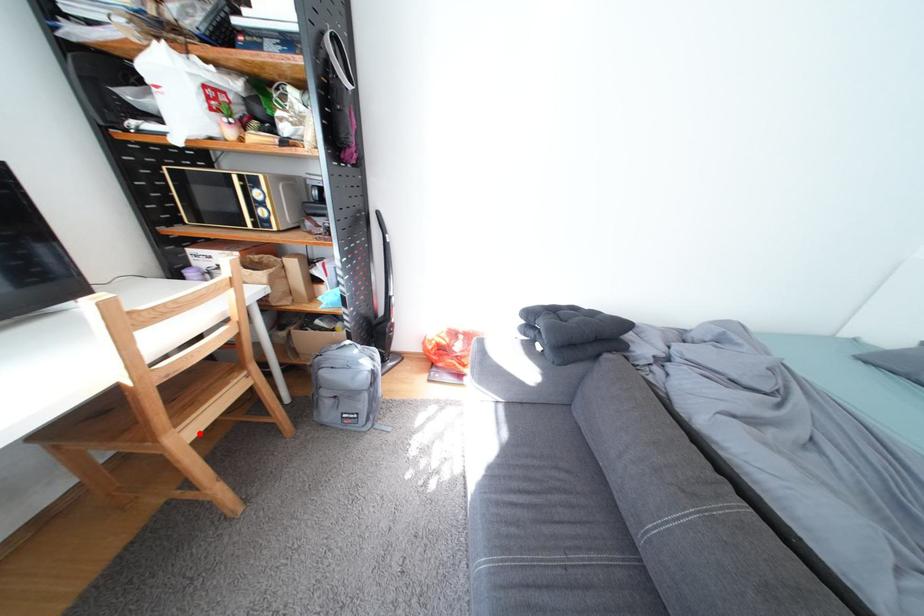
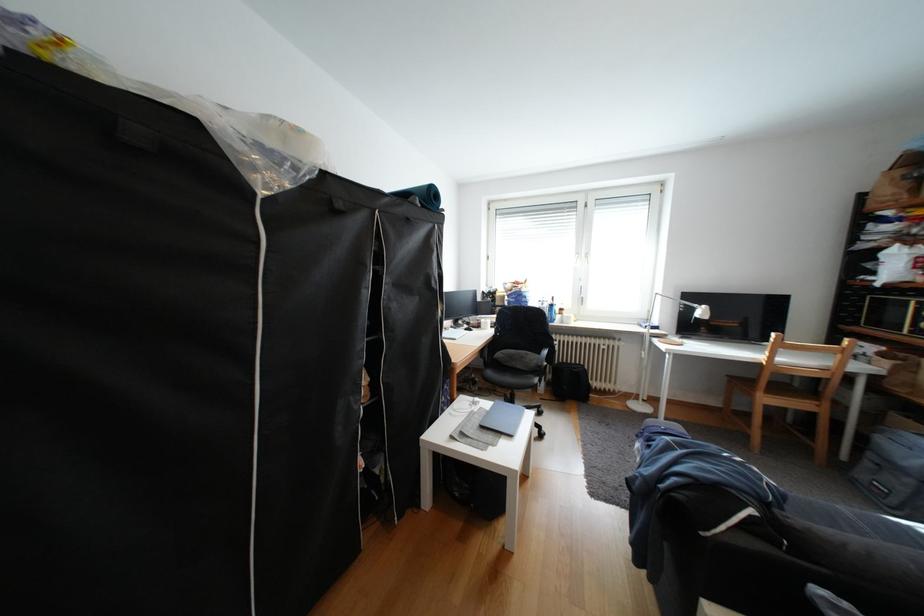
Question: I am providing you with two images of the same scene from different viewpoints. Image1 has a red point marked. In image2, the corresponding 3D location appears at what relative position? Reply with the corresponding letter.

Choices:
 (A) Closer
 (B) Farther

Answer: (A)